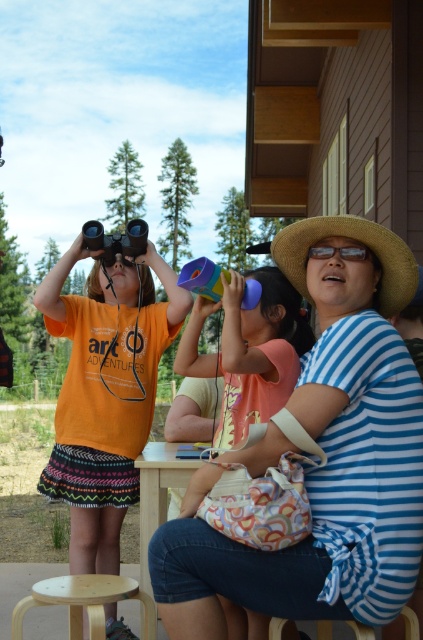
You are a photographer trying to capture a candid shot of the blue striped shirt at center and the matte plastic binoculars at center. Since you want to focus on the person holding the binoculars, which object should you adjust your camera focus on first?

The blue striped shirt at center is closer to the viewer than the matte plastic binoculars at center, so you should focus on the blue striped shirt at center first to ensure the person is in focus before adjusting for the binoculars.

You are standing at the point with coordinates point [142,512] and want to move to the point with coordinates point [360,282]. Which direction should you move to get closer to the viewer?

You should move towards point [360,282] because it is closer to the viewer than point [142,512].

You are a photographer trying to capture a group photo of the blue striped shirt at center and the wooden table at center. Based on their heights, which one should you adjust the camera angle to focus on first?

The blue striped shirt at center is much taller than the wooden table at center, so you should adjust the camera angle to focus on the blue striped shirt at center first to ensure it is properly framed in the shot.